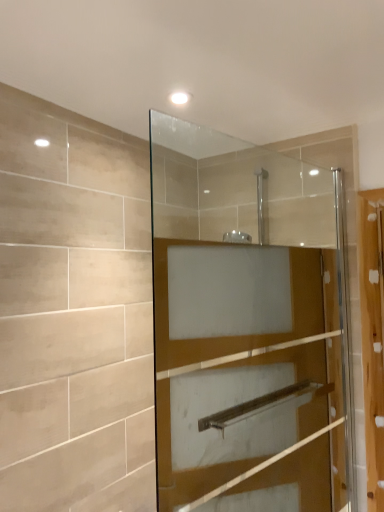
Question: Considering the positions of wooden screen door at right and clear glass shower door at center in the image, is wooden screen door at right bigger or smaller than clear glass shower door at center?

Choices:
 (A) small
 (B) big

Answer: (A)

Question: In terms of height, does wooden screen door at right look taller or shorter compared to clear glass shower door at center?

Choices:
 (A) short
 (B) tall

Answer: (A)

Question: From a real-world perspective, relative to clear glass shower door at center, is wooden screen door at right vertically above or below?

Choices:
 (A) below
 (B) above

Answer: (A)

Question: Is clear glass shower door at center inside or outside of wooden screen door at right?

Choices:
 (A) inside
 (B) outside

Answer: (B)

Question: In terms of width, does clear glass shower door at center look wider or thinner when compared to wooden screen door at right?

Choices:
 (A) thin
 (B) wide

Answer: (A)

Question: From the image's perspective, is clear glass shower door at center positioned above or below wooden screen door at right?

Choices:
 (A) below
 (B) above

Answer: (B)

Question: In the image, is clear glass shower door at center positioned in front of or behind wooden screen door at right?

Choices:
 (A) front
 (B) behind

Answer: (A)